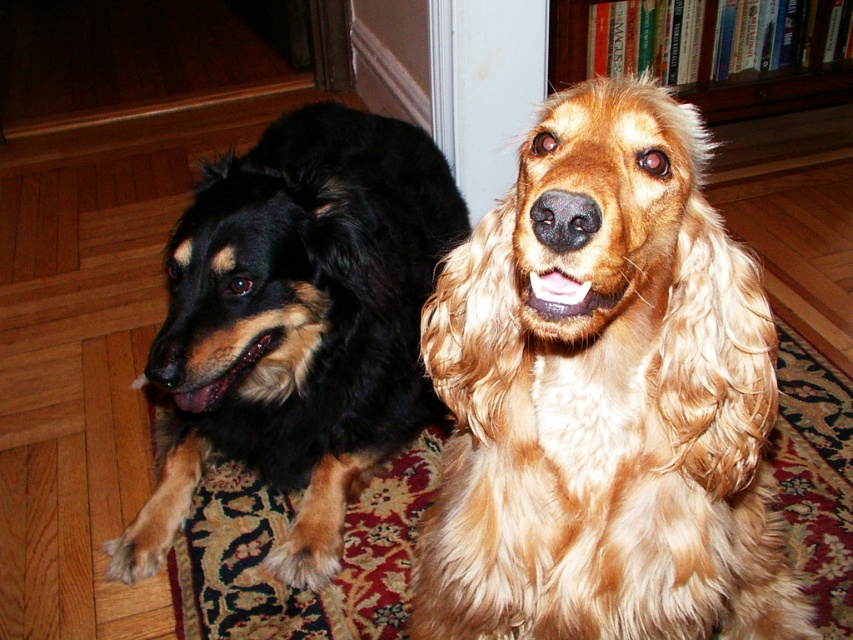
You are a photographer setting up a shot in this room. You need to focus on the golden fur dog at center and the wooden bookshelf at upper center. Which object should you adjust your camera focus to first if you want to capture both in sharp detail?

The golden fur dog at center is closer to the viewer than the wooden bookshelf at upper center, so you should focus on the golden fur dog at center first to ensure both are in focus.

You are a dog trainer standing 3 feet away from the wooden bookshelf at upper center. You want to give a treat to the black fur dog at left. Can you reach the dog without moving from your current position?

The black fur dog at left is 5.22 feet away from the wooden bookshelf at upper center. Since you are 3 feet away from the wooden bookshelf at upper center, the total distance between you and the black fur dog at left is 5.22 minus 3 equals 2.22 feet. Therefore, you can easily reach the black fur dog at left without moving.